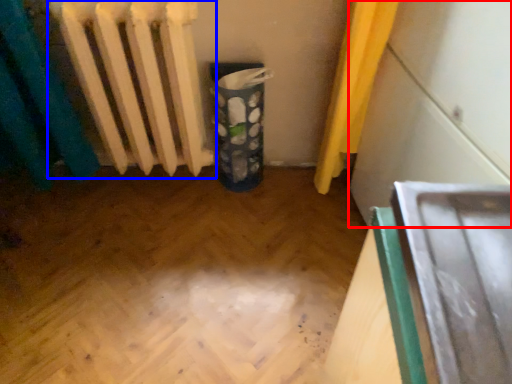
Question: Which object is closer to the camera taking this photo, wide (highlighted by a red box) or radiator (highlighted by a blue box)?

Choices:
 (A) wide
 (B) radiator

Answer: (A)